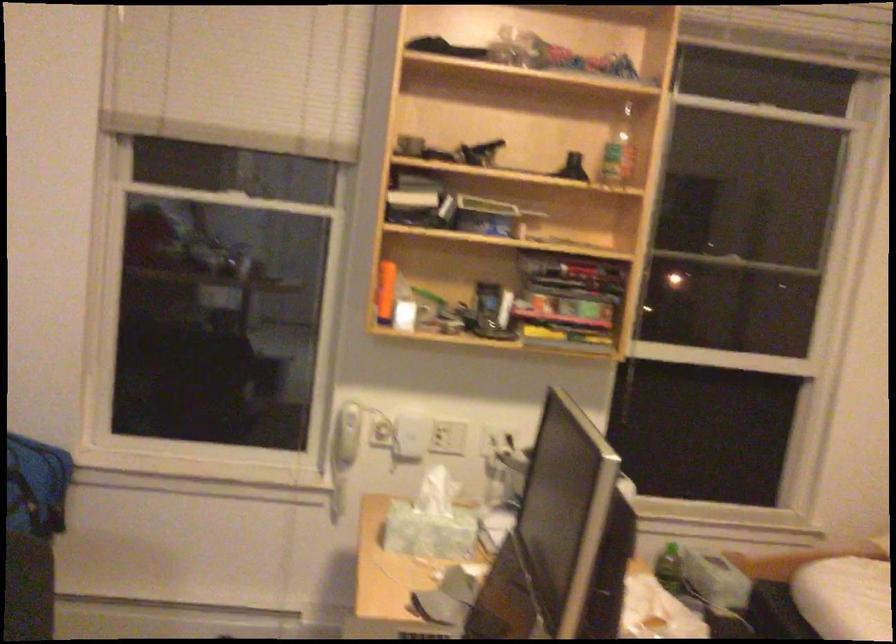
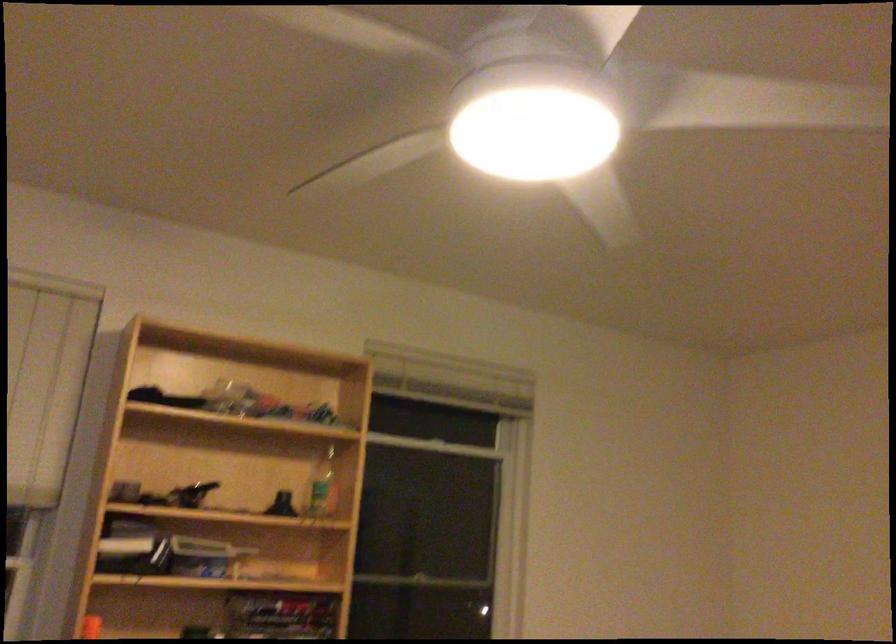
Locate, in the second image, the point that corresponds to pixel 618 152 in the first image.

(323, 486)